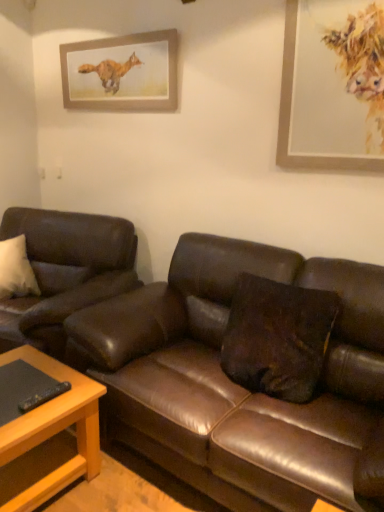
Image resolution: width=384 pixels, height=512 pixels. I want to click on leather couch at left, the 2th studio couch from the right, so tap(65, 271).

The image size is (384, 512). Find the location of `wooden picture frame at upper center, the second picture frame from the front`. wooden picture frame at upper center, the second picture frame from the front is located at coordinates (121, 73).

At what (x,y) coordinates should I click in order to perform the action: click on brown leather couch at center, which appears as the first studio couch when viewed from the right. Please return your answer as a coordinate pair (x, y). This screenshot has width=384, height=512. Looking at the image, I should click on (238, 385).

You are a GUI agent. You are given a task and a screenshot of the screen. Output one action in this format:
    pyautogui.click(x=<x>, y=<y>)
    Task: Click on the leather couch at left, arranged as the first studio couch when viewed from the left
    The height and width of the screenshot is (512, 384).
    Given the screenshot: What is the action you would take?
    pyautogui.click(x=65, y=271)

How many degrees apart are the facing directions of light brown wooden table at lower left and brown leather pillow at center?

The facing directions of light brown wooden table at lower left and brown leather pillow at center are 2.03 degrees apart.

Considering the sizes of light brown wooden table at lower left and brown leather pillow at center in the image, is light brown wooden table at lower left bigger or smaller than brown leather pillow at center?

In the image, light brown wooden table at lower left appears to be larger than brown leather pillow at center.

Find the location of `pillow lying behind the light brown wooden table at lower left`. pillow lying behind the light brown wooden table at lower left is located at coordinates (278, 337).

In the scene shown: Between light brown wooden table at lower left and brown leather pillow at center, which one is positioned in front?

light brown wooden table at lower left is closer to the camera.

From a real-world perspective, does brown leather couch at center, arranged as the 2th studio couch when viewed from the left, stand above wooden picture frame at upper center, which is the 2th picture frame in right-to-left order?

Actually, brown leather couch at center, arranged as the 2th studio couch when viewed from the left, is physically below wooden picture frame at upper center, which is the 2th picture frame in right-to-left order, in the real world.

In terms of height, does brown leather couch at center, arranged as the 2th studio couch when viewed from the left, look taller or shorter compared to wooden picture frame at upper center, the second picture frame from the front?

In the image, brown leather couch at center, arranged as the 2th studio couch when viewed from the left, appears to be taller than wooden picture frame at upper center, the second picture frame from the front.

Is the position of brown leather couch at center, which appears as the first studio couch when viewed from the right, less distant than that of wooden picture frame at upper center, which is the 2th picture frame in right-to-left order?

Yes, it is in front of wooden picture frame at upper center, which is the 2th picture frame in right-to-left order.

Is brown leather couch at center, which appears as the first studio couch when viewed from the right, wider than wooden picture frame at upper center, positioned as the 1th picture frame in back-to-front order?

Yes.

From the image's perspective, is wooden picture frame at upper right, which ranks as the 2th picture frame in back-to-front order, beneath brown leather couch at center, which appears as the first studio couch when viewed from the right?

No, from the image's perspective, wooden picture frame at upper right, which ranks as the 2th picture frame in back-to-front order, is not beneath brown leather couch at center, which appears as the first studio couch when viewed from the right.

Can you see wooden picture frame at upper right, which appears as the 2th picture frame when viewed from the left, touching brown leather couch at center, which appears as the first studio couch when viewed from the right?

No, wooden picture frame at upper right, which appears as the 2th picture frame when viewed from the left, is not next to brown leather couch at center, which appears as the first studio couch when viewed from the right.

In the scene shown: From a real-world perspective, which is physically above, wooden picture frame at upper right, which is the 1th picture frame in right-to-left order, or brown leather couch at center, which appears as the first studio couch when viewed from the right?

wooden picture frame at upper right, which is the 1th picture frame in right-to-left order, from a real-world perspective.

Between wooden picture frame at upper right, which ranks as the 2th picture frame in back-to-front order, and brown leather couch at center, arranged as the 2th studio couch when viewed from the left, which one has less height?

With less height is wooden picture frame at upper right, which ranks as the 2th picture frame in back-to-front order.

Could leather couch at left, arranged as the first studio couch when viewed from the left, be considered to be inside wooden picture frame at upper right, which is the 1th picture frame in right-to-left order?

That's incorrect, leather couch at left, arranged as the first studio couch when viewed from the left, is not inside wooden picture frame at upper right, which is the 1th picture frame in right-to-left order.

Is point (377, 36) closer to camera compared to point (59, 317)?

That is True.

Which object is closer to the camera taking this photo, wooden picture frame at upper right, which is the 1th picture frame in right-to-left order, or leather couch at left, arranged as the first studio couch when viewed from the left?

wooden picture frame at upper right, which is the 1th picture frame in right-to-left order, is closer to the camera.

Between wooden picture frame at upper right, which ranks as the 2th picture frame in back-to-front order, and leather couch at left, arranged as the first studio couch when viewed from the left, which one appears on the left side from the viewer's perspective?

leather couch at left, arranged as the first studio couch when viewed from the left.

Between wooden picture frame at upper center, which is the 1th picture frame in left-to-right order, and brown leather couch at center, arranged as the 2th studio couch when viewed from the left, which one has larger width?

brown leather couch at center, arranged as the 2th studio couch when viewed from the left, is wider.

Which of these two, wooden picture frame at upper center, which is the 1th picture frame in left-to-right order, or brown leather couch at center, which appears as the first studio couch when viewed from the right, stands taller?

brown leather couch at center, which appears as the first studio couch when viewed from the right.

Is wooden picture frame at upper center, the second picture frame from the front, to the left or to the right of brown leather couch at center, which appears as the first studio couch when viewed from the right, in the image?

Clearly, wooden picture frame at upper center, the second picture frame from the front, is on the left of brown leather couch at center, which appears as the first studio couch when viewed from the right, in the image.

What are the coordinates of `studio couch on the right side of wooden picture frame at upper center, which is the 1th picture frame in left-to-right order` in the screenshot? It's located at click(238, 385).

Is leather couch at left, the 2th studio couch from the right, far from wooden picture frame at upper center, which is the 1th picture frame in left-to-right order?

Yes, leather couch at left, the 2th studio couch from the right, is far from wooden picture frame at upper center, which is the 1th picture frame in left-to-right order.

Consider the image. Between leather couch at left, arranged as the first studio couch when viewed from the left, and wooden picture frame at upper center, the second picture frame from the front, which one has smaller size?

wooden picture frame at upper center, the second picture frame from the front, is smaller.

Is leather couch at left, the 2th studio couch from the right, positioned with its back to wooden picture frame at upper center, which is the 2th picture frame in right-to-left order?

No, leather couch at left, the 2th studio couch from the right, is not facing the opposite direction of wooden picture frame at upper center, which is the 2th picture frame in right-to-left order.

Consider the image. From the image's perspective, between leather couch at left, arranged as the first studio couch when viewed from the left, and wooden picture frame at upper center, the second picture frame from the front, which one is located above?

wooden picture frame at upper center, the second picture frame from the front, from the image's perspective.

Between point (21, 476) and point (190, 327), which one is positioned behind?

Point (190, 327)

Consider the image. Considering the relative positions of light brown wooden table at lower left and brown leather couch at center, which appears as the first studio couch when viewed from the right, in the image provided, is light brown wooden table at lower left behind brown leather couch at center, which appears as the first studio couch when viewed from the right,?

Yes, light brown wooden table at lower left is further from the viewer.

Who is taller, light brown wooden table at lower left or brown leather couch at center, arranged as the 2th studio couch when viewed from the left?

brown leather couch at center, arranged as the 2th studio couch when viewed from the left.

Measure the distance from light brown wooden table at lower left to brown leather couch at center, which appears as the first studio couch when viewed from the right.

The distance of light brown wooden table at lower left from brown leather couch at center, which appears as the first studio couch when viewed from the right, is 18.56 inches.

Locate an element on the screen. pillow on the right of light brown wooden table at lower left is located at coordinates tap(278, 337).

This screenshot has width=384, height=512. What are the coordinates of `picture frame that is the 2nd object located behind the brown leather couch at center, arranged as the 2th studio couch when viewed from the left` in the screenshot? It's located at (121, 73).

From the image, which object appears to be nearer to wooden picture frame at upper right, which ranks as the 2th picture frame in back-to-front order, brown leather pillow at center or brown leather couch at center, which appears as the first studio couch when viewed from the right?

brown leather pillow at center lies closer to wooden picture frame at upper right, which ranks as the 2th picture frame in back-to-front order, than the other object.

From the picture: From the image, which object appears to be nearer to leather couch at left, the 2th studio couch from the right, wooden picture frame at upper right, marked as the 1th picture frame in a front-to-back arrangement, or wooden picture frame at upper center, which is the 2th picture frame in right-to-left order?

wooden picture frame at upper center, which is the 2th picture frame in right-to-left order, is closer to leather couch at left, the 2th studio couch from the right.

Considering their positions, is leather couch at left, arranged as the first studio couch when viewed from the left, positioned closer to brown leather pillow at center than light brown wooden table at lower left?

light brown wooden table at lower left.

Which object lies further to the anchor point light brown wooden table at lower left, leather couch at left, the 2th studio couch from the right, or brown leather couch at center, which appears as the first studio couch when viewed from the right?

The object further to light brown wooden table at lower left is leather couch at left, the 2th studio couch from the right.

Considering their positions, is wooden picture frame at upper right, which ranks as the 2th picture frame in back-to-front order, positioned further to light brown wooden table at lower left than leather couch at left, the 2th studio couch from the right?

Based on the image, wooden picture frame at upper right, which ranks as the 2th picture frame in back-to-front order, appears to be further to light brown wooden table at lower left.

Based on their spatial positions, is brown leather couch at center, which appears as the first studio couch when viewed from the right, or leather couch at left, arranged as the first studio couch when viewed from the left, further from brown leather pillow at center?

Based on the image, leather couch at left, arranged as the first studio couch when viewed from the left, appears to be further to brown leather pillow at center.

Which object lies nearer to the anchor point light brown wooden table at lower left, wooden picture frame at upper right, which appears as the 2th picture frame when viewed from the left, or brown leather couch at center, arranged as the 2th studio couch when viewed from the left?

Based on the image, brown leather couch at center, arranged as the 2th studio couch when viewed from the left, appears to be nearer to light brown wooden table at lower left.

Considering their positions, is light brown wooden table at lower left positioned further to wooden picture frame at upper right, which is the 1th picture frame in right-to-left order, than wooden picture frame at upper center, the second picture frame from the front?

Among the two, light brown wooden table at lower left is located further to wooden picture frame at upper right, which is the 1th picture frame in right-to-left order.

Where is `pillow located between leather couch at left, arranged as the first studio couch when viewed from the left, and wooden picture frame at upper right, which appears as the 2th picture frame when viewed from the left, in the left-right direction`? The image size is (384, 512). pillow located between leather couch at left, arranged as the first studio couch when viewed from the left, and wooden picture frame at upper right, which appears as the 2th picture frame when viewed from the left, in the left-right direction is located at coordinates (278, 337).

In order to click on picture frame between wooden picture frame at upper center, positioned as the 1th picture frame in back-to-front order, and light brown wooden table at lower left, in the vertical direction in this screenshot , I will do `click(332, 86)`.

The width and height of the screenshot is (384, 512). I want to click on studio couch between leather couch at left, arranged as the first studio couch when viewed from the left, and brown leather pillow at center from left to right, so click(238, 385).

At what (x,y) coordinates should I click in order to perform the action: click on pillow between wooden picture frame at upper center, positioned as the 1th picture frame in back-to-front order, and light brown wooden table at lower left vertically. Please return your answer as a coordinate pair (x, y). This screenshot has width=384, height=512. Looking at the image, I should click on (278, 337).